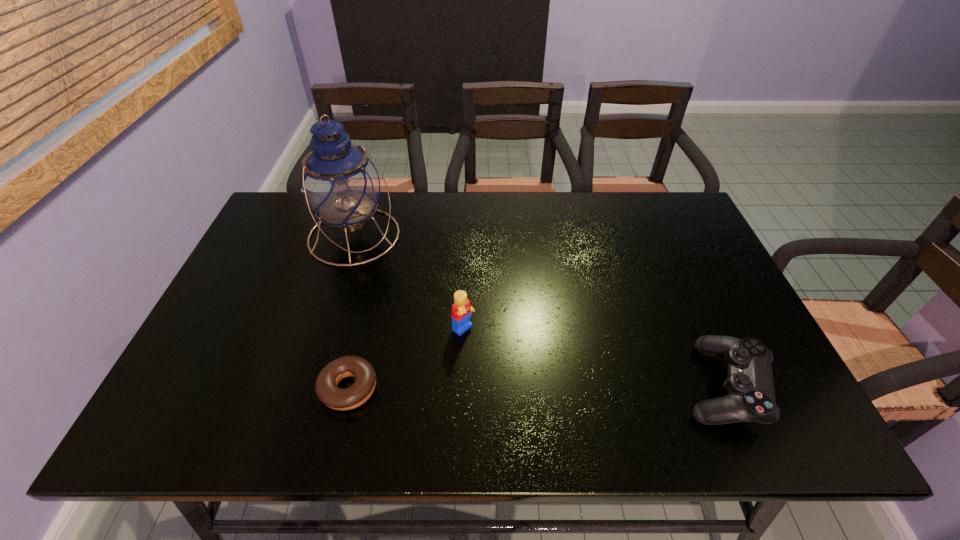
I want to click on doughnut, so click(x=326, y=387).

Identify the location of control. (750, 386).

Identify the location of the third tallest object. (750, 386).

You are a GUI agent. You are given a task and a screenshot of the screen. Output one action in this format:
    pyautogui.click(x=<x>, y=<y>)
    Task: Click on the second object from right to left
    
    Given the screenshot: What is the action you would take?
    (x=461, y=309)

You are a GUI agent. You are given a task and a screenshot of the screen. Output one action in this format:
    pyautogui.click(x=<x>, y=<y>)
    Task: Click on the third nearest object
    The width and height of the screenshot is (960, 540).
    Given the screenshot: What is the action you would take?
    pyautogui.click(x=461, y=309)

Image resolution: width=960 pixels, height=540 pixels. I want to click on the farthest object, so click(x=339, y=183).

The width and height of the screenshot is (960, 540). In order to click on lantern in this screenshot , I will do `click(339, 183)`.

At what (x,y) coordinates should I click in order to perform the action: click on vacant space situated 0.100m on the left of the shortest object. Please return your answer as a coordinate pair (x, y). The image size is (960, 540). Looking at the image, I should click on (274, 388).

Identify the location of vacant space located on the back of the third tallest object. The height and width of the screenshot is (540, 960). (679, 286).

The height and width of the screenshot is (540, 960). Find the location of `vacant space located on the face of the Lego`. vacant space located on the face of the Lego is located at coordinates (540, 394).